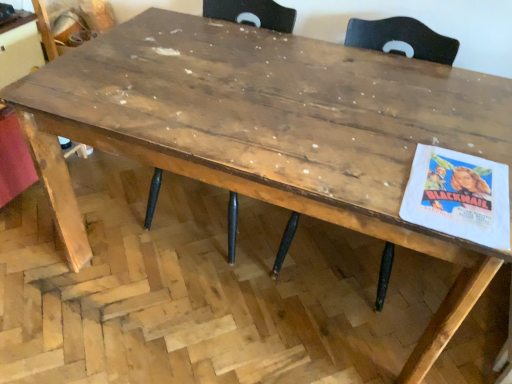
The image size is (512, 384). Find the location of `free spot to the left of wooden chair at center, which ranks as the 1th chair in left-to-right order`. free spot to the left of wooden chair at center, which ranks as the 1th chair in left-to-right order is located at coordinates (100, 196).